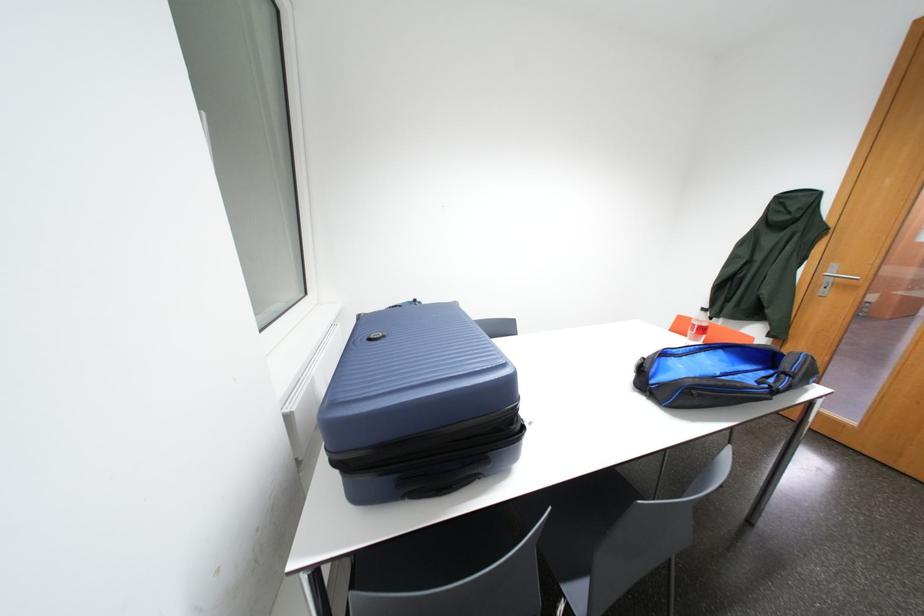
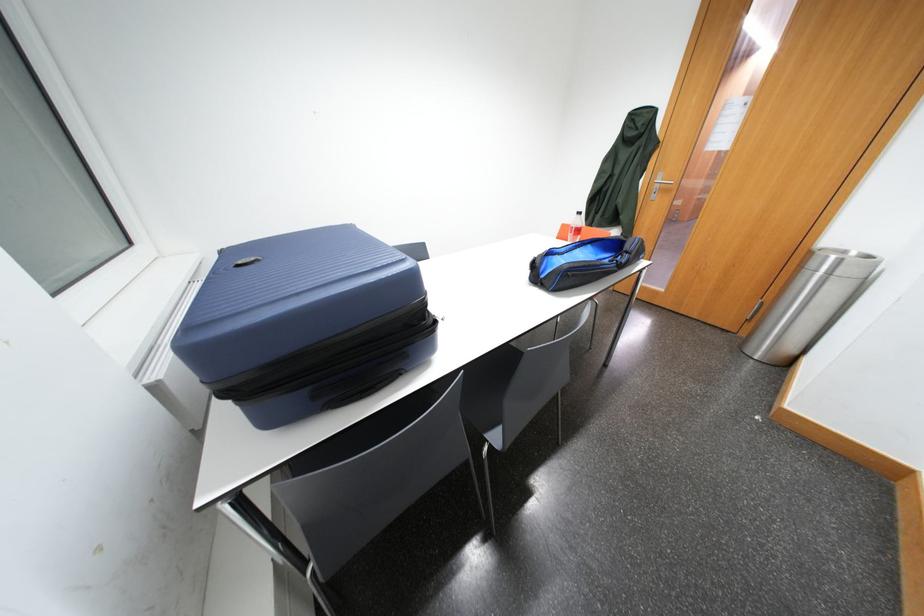
Question: What movement of the cameraman would produce the second image?

Choices:
 (A) Left
 (B) Right
 (C) Forward
 (D) Backward

Answer: (B)